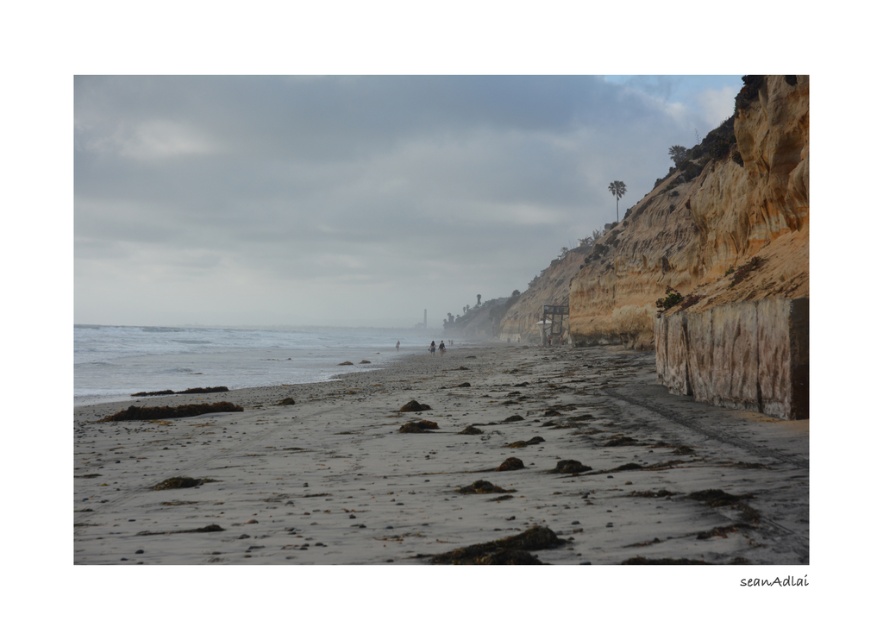
Is gray sandy beach at lower center shorter than brown rocky cliff at right?

Yes.

Does gray sandy beach at lower center come in front of brown rocky cliff at right?

Yes, it is in front of brown rocky cliff at right.

What do you see at coordinates (446, 468) in the screenshot? I see `gray sandy beach at lower center` at bounding box center [446, 468].

The width and height of the screenshot is (883, 640). I want to click on gray sandy beach at lower center, so click(x=446, y=468).

Does gray sandy beach at lower center appear under blurred human figure at center?

No, gray sandy beach at lower center is not below blurred human figure at center.

Does point (570, 548) lie in front of point (429, 342)?

Yes, point (570, 548) is in front of point (429, 342).

Find the location of a particular element. The height and width of the screenshot is (640, 883). gray sandy beach at lower center is located at coordinates [446, 468].

Can you confirm if brown rocky cliff at right is positioned above blurred human figure at center?

Yes, brown rocky cliff at right is above blurred human figure at center.

Does brown rocky cliff at right appear on the left side of blurred human figure at center?

No, brown rocky cliff at right is not to the left of blurred human figure at center.

Describe the element at coordinates (687, 230) in the screenshot. I see `brown rocky cliff at right` at that location.

Find the location of a particular element. The image size is (883, 640). brown rocky cliff at right is located at coordinates (687, 230).